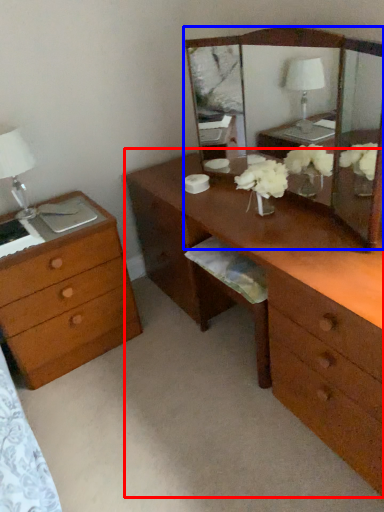
Question: Which object is further to the camera taking this photo, desk (highlighted by a red box) or mirror (highlighted by a blue box)?

Choices:
 (A) desk
 (B) mirror

Answer: (B)